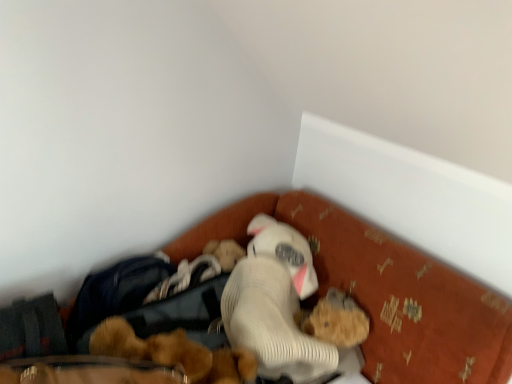
Question: Which direction should I rotate to face fluffy brown teddy bear at center, positioned as the 1th toy in left-to-right order, — up or down?

Choices:
 (A) up
 (B) down

Answer: (B)

Question: Is fluffy brown teddy bear at center, positioned as the 1th toy in left-to-right order, in front of fuzzy brown teddy bear at lower center, placed as the 1th toy when sorted from right to left?

Choices:
 (A) yes
 (B) no

Answer: (A)

Question: Is fluffy brown teddy bear at center, positioned as the 1th toy in left-to-right order, wider than fuzzy brown teddy bear at lower center, acting as the second toy starting from the left?

Choices:
 (A) yes
 (B) no

Answer: (A)

Question: From the image's perspective, would you say fluffy brown teddy bear at center, positioned as the 1th toy in left-to-right order, is shown under fuzzy brown teddy bear at lower center, placed as the 1th toy when sorted from right to left?

Choices:
 (A) no
 (B) yes

Answer: (B)

Question: Is the depth of fluffy brown teddy bear at center, the second toy when ordered from right to left, greater than that of fuzzy brown teddy bear at lower center, acting as the second toy starting from the left?

Choices:
 (A) yes
 (B) no

Answer: (B)

Question: From the image's perspective, is fluffy brown teddy bear at center, positioned as the 1th toy in left-to-right order, above fuzzy brown teddy bear at lower center, acting as the second toy starting from the left?

Choices:
 (A) yes
 (B) no

Answer: (B)

Question: Considering the relative sizes of fluffy brown teddy bear at center, positioned as the 1th toy in left-to-right order, and fuzzy brown teddy bear at lower center, acting as the second toy starting from the left, in the image provided, is fluffy brown teddy bear at center, positioned as the 1th toy in left-to-right order, thinner than fuzzy brown teddy bear at lower center, acting as the second toy starting from the left,?

Choices:
 (A) yes
 (B) no

Answer: (B)

Question: From the image's perspective, is white ribbed plush at center located above fluffy brown teddy bear at center, the second toy when ordered from right to left?

Choices:
 (A) no
 (B) yes

Answer: (B)

Question: Is white ribbed plush at center shorter than fluffy brown teddy bear at center, the second toy when ordered from right to left?

Choices:
 (A) yes
 (B) no

Answer: (B)

Question: Is fluffy brown teddy bear at center, the second toy when ordered from right to left, completely or partially inside white ribbed plush at center?

Choices:
 (A) yes
 (B) no

Answer: (B)

Question: From the image's perspective, is white ribbed plush at center beneath fluffy brown teddy bear at center, positioned as the 1th toy in left-to-right order?

Choices:
 (A) yes
 (B) no

Answer: (B)

Question: Is white ribbed plush at center positioned before fluffy brown teddy bear at center, the second toy when ordered from right to left?

Choices:
 (A) yes
 (B) no

Answer: (A)

Question: Is white ribbed plush at center next to fluffy brown teddy bear at center, positioned as the 1th toy in left-to-right order?

Choices:
 (A) yes
 (B) no

Answer: (B)

Question: Is velvet orange bed at lower center located outside fluffy brown teddy bear at center, positioned as the 1th toy in left-to-right order?

Choices:
 (A) yes
 (B) no

Answer: (A)